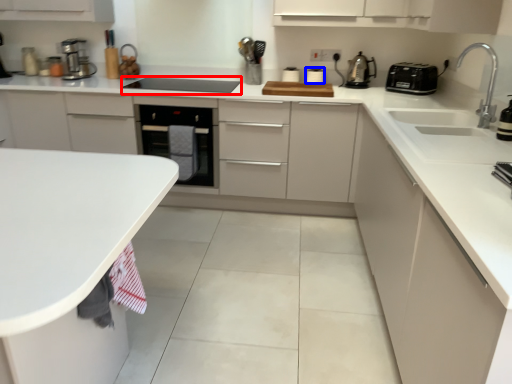
Question: Which of the following is the farthest to the observer, appliance (highlighted by a red box) or appliance (highlighted by a blue box)?

Choices:
 (A) appliance
 (B) appliance

Answer: (B)